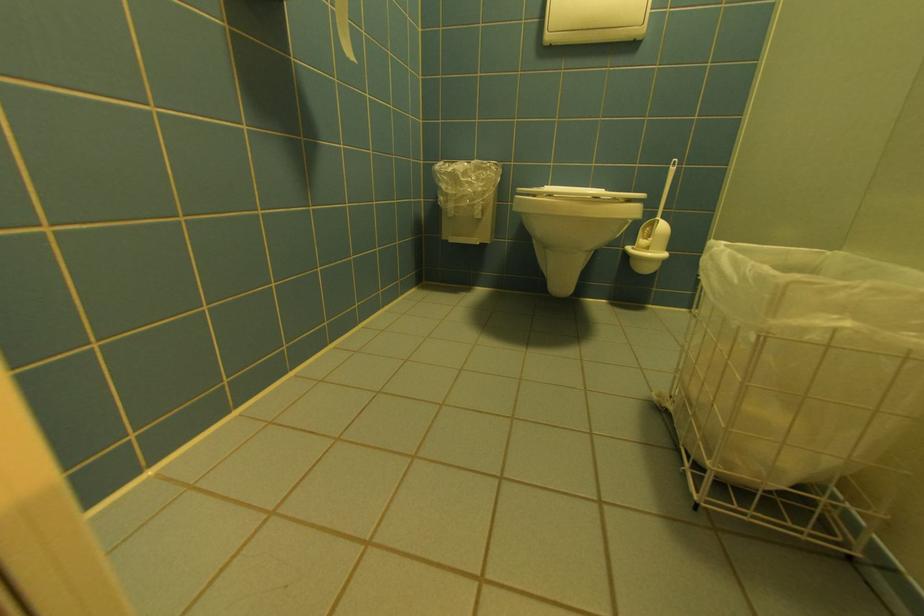
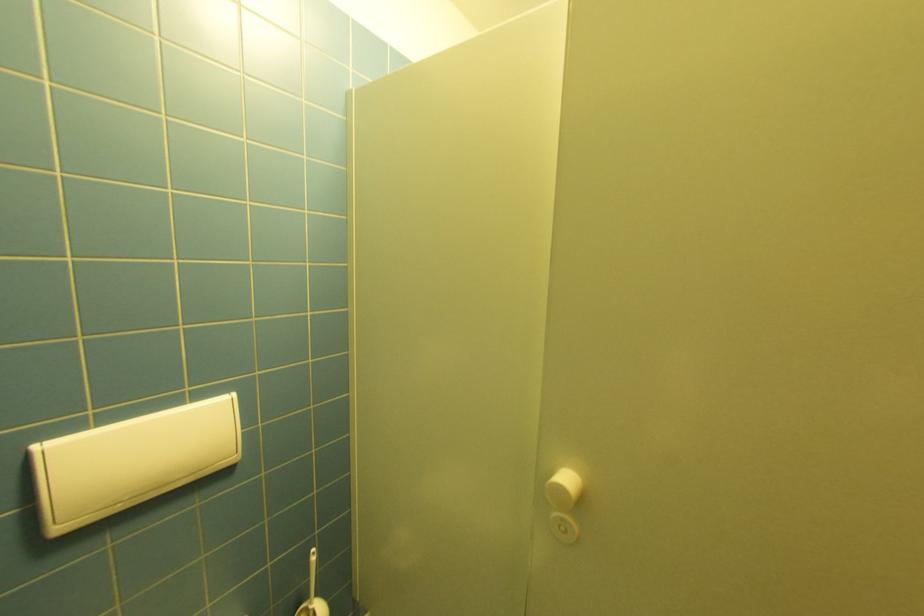
Locate, in the second image, the point that corresponds to the point at 554,38 in the first image.

(66, 530)